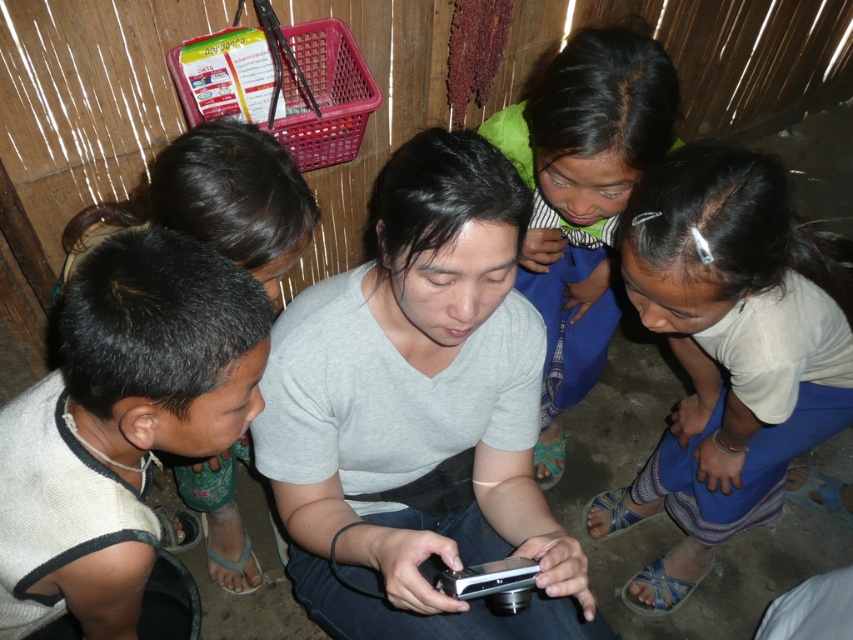
Question: Which point is farther to the camera?

Choices:
 (A) white fabric shirt at lower right
 (B) silver metallic smartphone at center
 (C) green fabric shirt at upper center
 (D) gray matte shirt at center

Answer: (C)

Question: Can you confirm if white fabric shirt at lower right is wider than green fabric shirt at upper center?

Choices:
 (A) no
 (B) yes

Answer: (B)

Question: Which of the following is the farthest from the observer?

Choices:
 (A) (148, 212)
 (B) (550, 269)

Answer: (B)

Question: Observing the image, what is the correct spatial positioning of white fabric shirt at lower right in reference to green fabric shirt at upper center?

Choices:
 (A) right
 (B) left

Answer: (A)

Question: Which point appears farthest from the camera in this image?

Choices:
 (A) (540, 305)
 (B) (625, 516)
 (C) (199, 186)

Answer: (B)

Question: In this image, where is gray matte shirt at center located relative to silver metallic smartphone at center?

Choices:
 (A) right
 (B) left

Answer: (B)